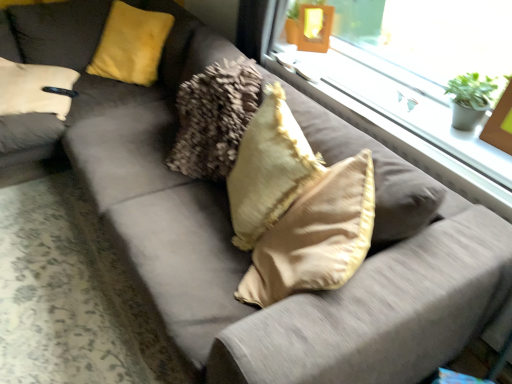
Question: In the image, is yellow fuzzy pillow at upper left, the 1th pillow in the top-to-bottom sequence, positioned in front of or behind wooden picture frame at upper right?

Choices:
 (A) behind
 (B) front

Answer: (A)

Question: Is yellow fuzzy pillow at upper left, the 1th pillow in the top-to-bottom sequence, wider or thinner than wooden picture frame at upper right?

Choices:
 (A) wide
 (B) thin

Answer: (A)

Question: Which is nearer to the green matte houseplant at upper right?

Choices:
 (A) clear glass window at upper right
 (B) yellow fuzzy pillow at upper left, the 1th pillow in the top-to-bottom sequence
 (C) wooden picture frame at upper right
 (D) beige soft cushion at center, the first pillow positioned from the right

Answer: (C)

Question: Which of these objects is positioned farthest from the wooden picture frame at upper right?

Choices:
 (A) clear glass window at upper right
 (B) green matte houseplant at upper right
 (C) yellow fuzzy pillow at upper left, the first pillow positioned from the back
 (D) beige soft cushion at center, the first pillow positioned from the right

Answer: (C)